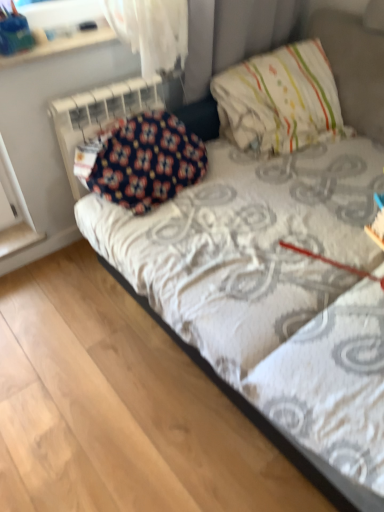
This screenshot has width=384, height=512. I want to click on navy blue fabric at left, so click(x=99, y=116).

Describe the element at coordinates (99, 116) in the screenshot. I see `navy blue fabric at left` at that location.

I want to click on navy blue fabric at left, so click(99, 116).